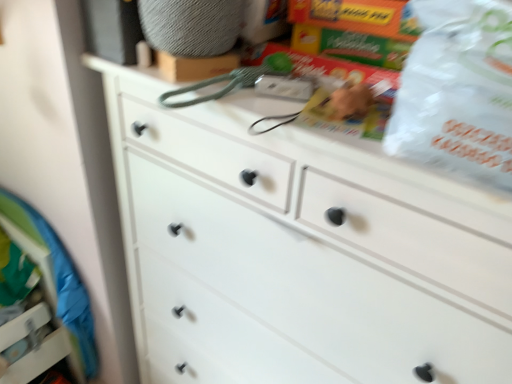
Where is `white matte chest of drawers at center`? The height and width of the screenshot is (384, 512). white matte chest of drawers at center is located at coordinates (298, 251).

Image resolution: width=512 pixels, height=384 pixels. Describe the element at coordinates (298, 251) in the screenshot. I see `white matte chest of drawers at center` at that location.

Identify the location of white matte chest of drawers at center. The width and height of the screenshot is (512, 384). (298, 251).